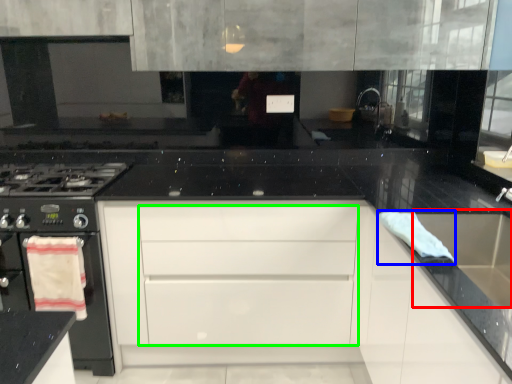
Question: Based on their relative distances, which object is nearer to sink (highlighted by a red box)? Choose from material (highlighted by a blue box) and drawer (highlighted by a green box).

Choices:
 (A) material
 (B) drawer

Answer: (A)